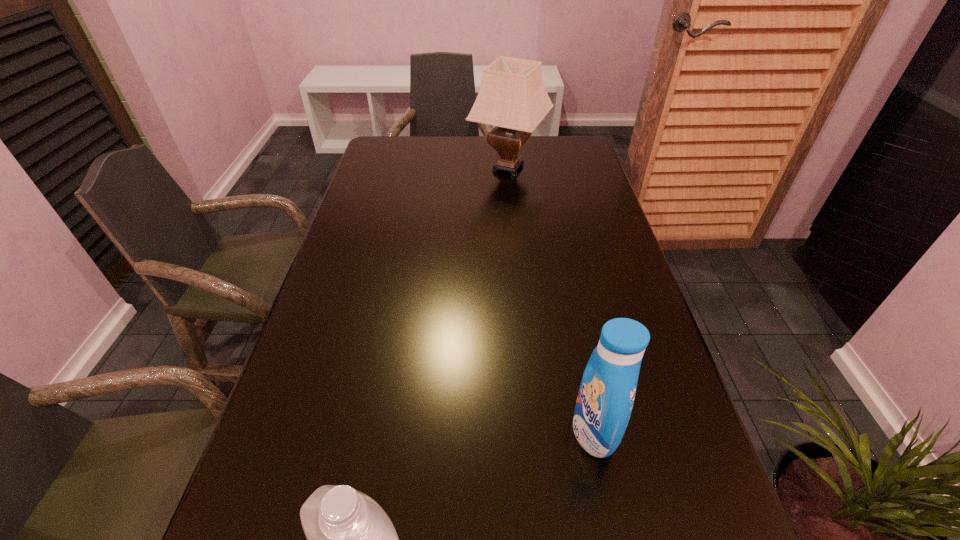
Identify the location of the farthest object. The width and height of the screenshot is (960, 540). (512, 97).

Locate an element on the screen. Image resolution: width=960 pixels, height=540 pixels. lampshade is located at coordinates (512, 97).

Where is `the farther detergent`? the farther detergent is located at coordinates (606, 395).

I want to click on the right detergent, so click(606, 395).

Where is `blank space located 0.060m on the front of the lampshade`? The width and height of the screenshot is (960, 540). blank space located 0.060m on the front of the lampshade is located at coordinates (512, 200).

Identify the location of vacant space positioned on the front-facing side of the farther detergent. (378, 430).

The height and width of the screenshot is (540, 960). I want to click on blank space located on the front-facing side of the farther detergent, so coord(546,430).

What are the coordinates of `free point located on the front-facing side of the farther detergent` in the screenshot? It's located at (476, 430).

Where is `object located in the far edge section of the desktop`? object located in the far edge section of the desktop is located at coordinates (512, 97).

Find the location of a particular element. lampshade that is positioned at the right edge is located at coordinates (512, 97).